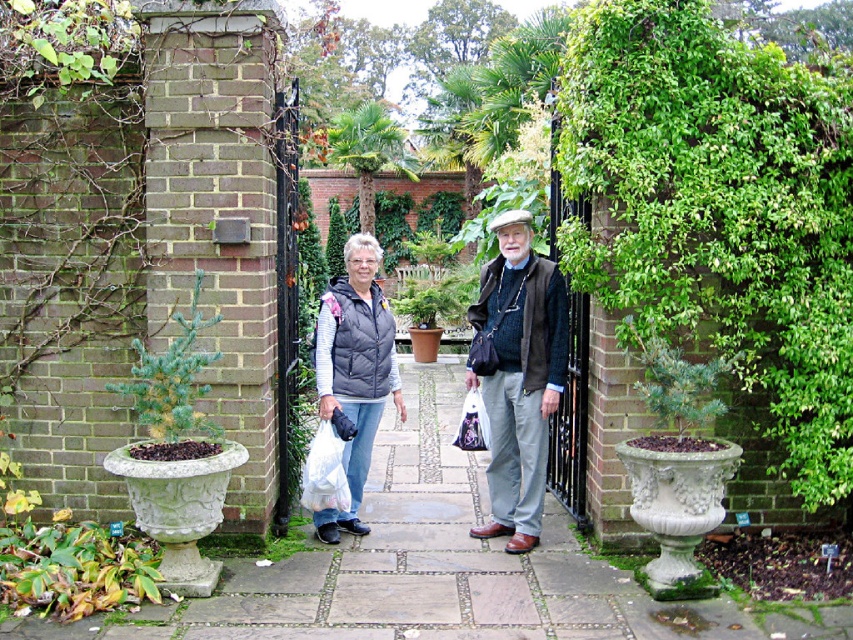
Question: Can you confirm if brown leather jacket at center is wider than matte black vest at center?

Choices:
 (A) yes
 (B) no

Answer: (A)

Question: Which point is closer to the camera?

Choices:
 (A) (537, 410)
 (B) (207, 317)
 (C) (352, 502)
 (D) (28, 570)

Answer: (D)

Question: Is brown leather jacket at center thinner than matte black vest at center?

Choices:
 (A) yes
 (B) no

Answer: (B)

Question: Which of the following is the farthest from the observer?

Choices:
 (A) variegated leafy plant at lower left
 (B) green needle-like plant at left

Answer: (B)

Question: Among these points, which one is nearest to the camera?

Choices:
 (A) (137, 374)
 (B) (509, 404)
 (C) (347, 410)
 (D) (90, 573)

Answer: (A)

Question: Does matte gray vest at center come in front of green needle-like plant at left?

Choices:
 (A) yes
 (B) no

Answer: (B)